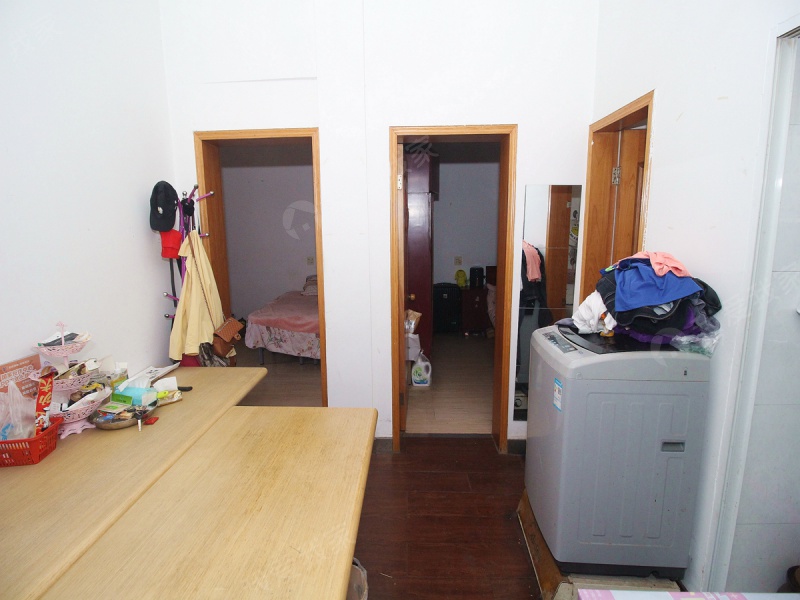
I want to click on white wall, so click(x=382, y=82).